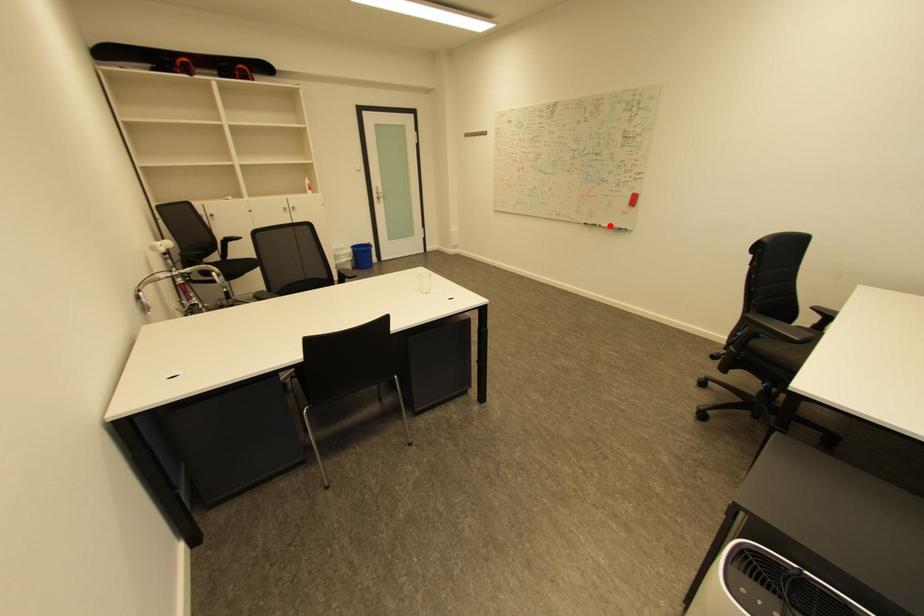
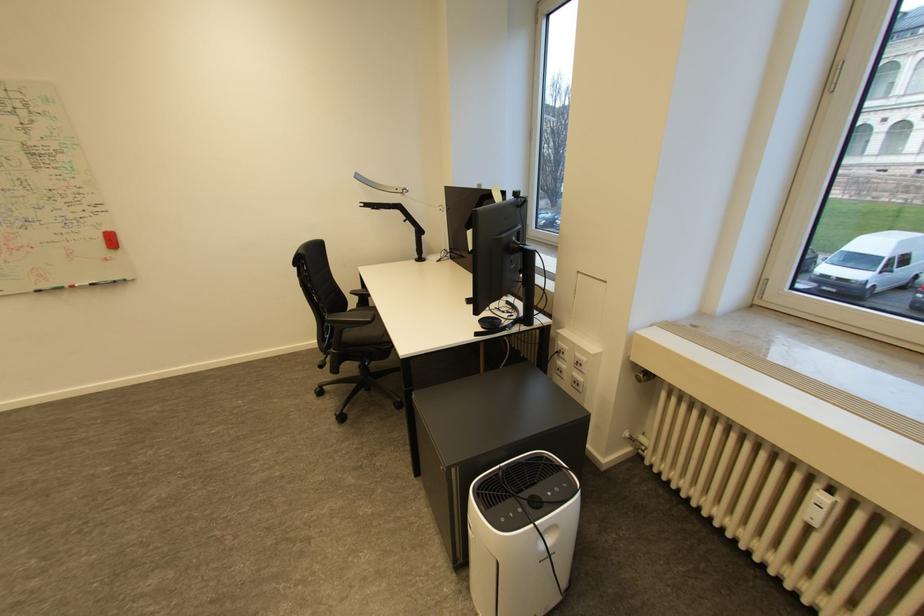
Question: A red point is marked in image1. In image2, is the corresponding 3D point closer to the camera or farther? Reply with the corresponding letter.

Choices:
 (A) The corresponding 3D point is closer.
 (B) The corresponding 3D point is farther.

Answer: (B)